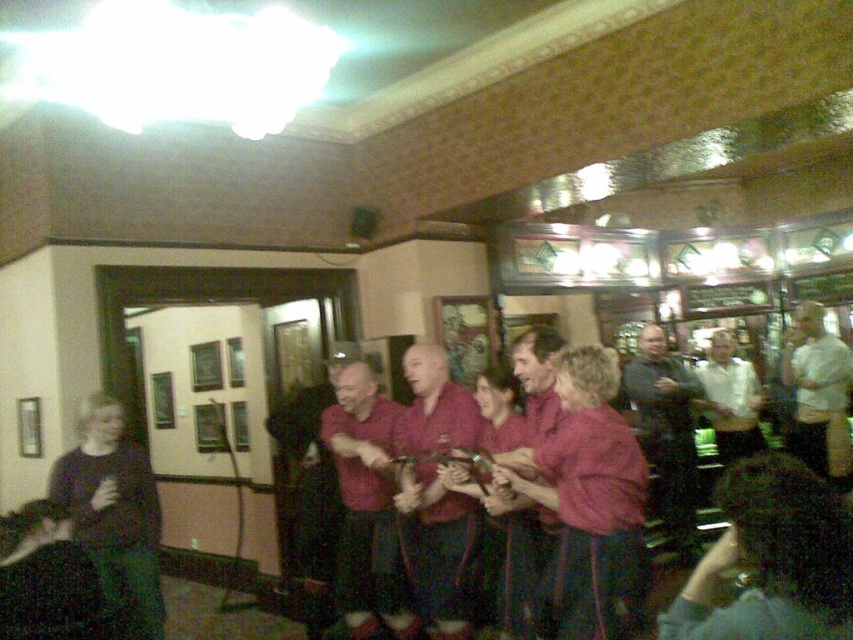
Question: Observing the image, what is the correct spatial positioning of dark gray sweater at center in reference to white shirt at center?

Choices:
 (A) below
 (B) above

Answer: (A)

Question: Is maroon fabric shirt at center below white shirt at center?

Choices:
 (A) no
 (B) yes

Answer: (B)

Question: Based on their relative distances, which object is farther from the dark gray sweater at center?

Choices:
 (A) matte red shirt at center
 (B) white shirt at center

Answer: (A)

Question: Which point is farther to the camera?

Choices:
 (A) maroon fabric shirt at center
 (B) dark gray sweater at center

Answer: (B)

Question: Which point is closer to the camera?

Choices:
 (A) (x=693, y=541)
 (B) (x=815, y=420)
 (C) (x=393, y=620)
 (D) (x=437, y=586)

Answer: (D)

Question: Is maroon fabric shirt at center thinner than dark gray sweater at center?

Choices:
 (A) yes
 (B) no

Answer: (A)